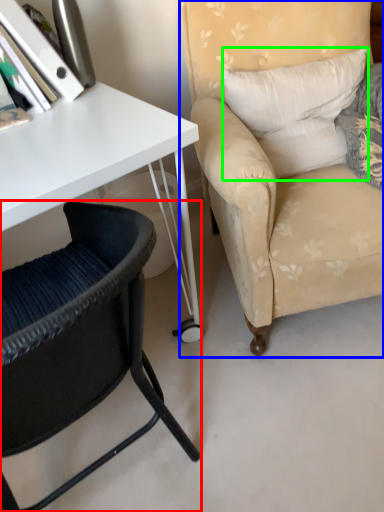
Question: Which is farther away from chair (highlighted by a red box)? chair (highlighted by a blue box) or pillow (highlighted by a green box)?

Choices:
 (A) chair
 (B) pillow

Answer: (B)